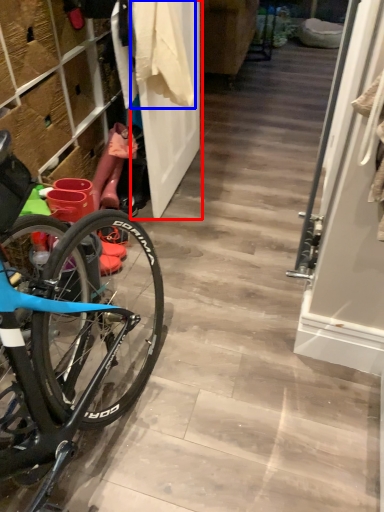
Question: Which object appears farthest to the camera in this image, door (highlighted by a red box) or clothing (highlighted by a blue box)?

Choices:
 (A) door
 (B) clothing

Answer: (A)